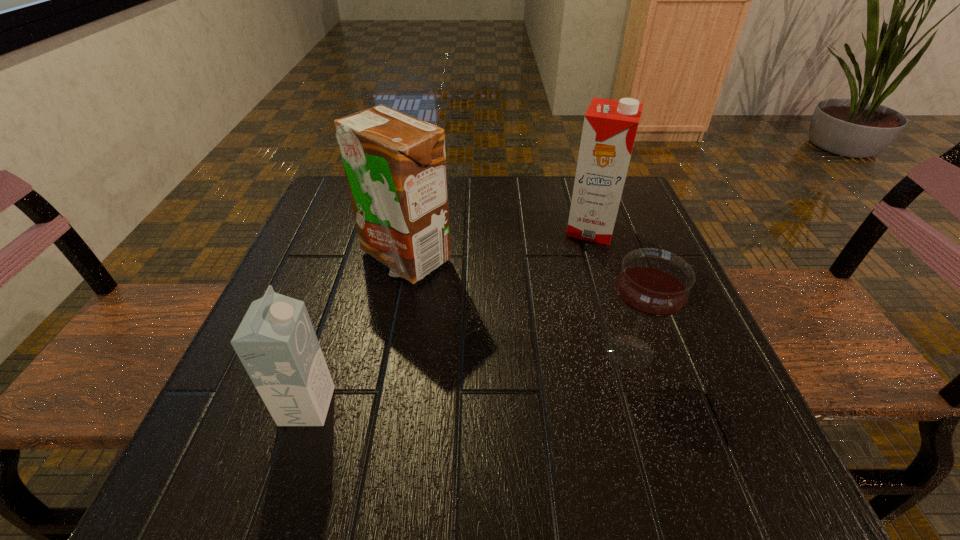
This screenshot has height=540, width=960. I want to click on unoccupied area between the shortest object and the nearest object, so click(x=468, y=379).

Find the location of `free space between the nearest object and the rightmost carton`. free space between the nearest object and the rightmost carton is located at coordinates (449, 317).

Where is `free spot between the nearest object and the rightmost carton`? free spot between the nearest object and the rightmost carton is located at coordinates (449, 317).

The height and width of the screenshot is (540, 960). Find the location of `free space between the wineglass and the nearest carton`. free space between the wineglass and the nearest carton is located at coordinates (468, 379).

The image size is (960, 540). Identify the location of the second closest object to the shortest object. (395, 165).

At what (x,y) coordinates should I click in order to perform the action: click on object that is the closest to the second nearest object. Please return your answer as a coordinate pair (x, y). Image resolution: width=960 pixels, height=540 pixels. Looking at the image, I should click on (610, 126).

At what (x,y) coordinates should I click in order to perform the action: click on the closest carton to the wineglass. Please return your answer as a coordinate pair (x, y). This screenshot has height=540, width=960. Looking at the image, I should click on (610, 126).

Where is `the second closest carton to the wineglass`? Image resolution: width=960 pixels, height=540 pixels. the second closest carton to the wineglass is located at coordinates pos(395,165).